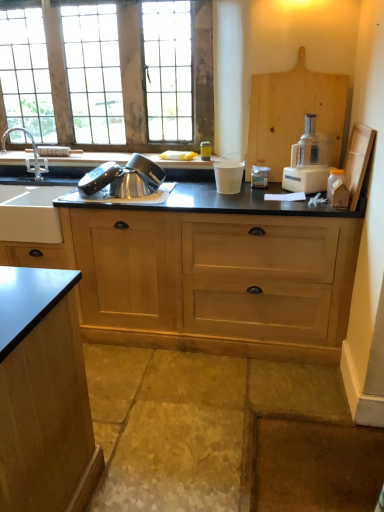
Question: From the image's perspective, is white plastic food processor at right located above or below metallic silver colander at sink?

Choices:
 (A) below
 (B) above

Answer: (B)

Question: Considering the positions of white plastic food processor at right and metallic silver colander at sink in the image, is white plastic food processor at right bigger or smaller than metallic silver colander at sink?

Choices:
 (A) big
 (B) small

Answer: (A)

Question: Which object is positioned farthest from the wooden window at upper left?

Choices:
 (A) black matte countertop at center
 (B) metallic silver colander at sink
 (C) white plastic food processor at right
 (D) silver metallic faucet at left

Answer: (C)

Question: Which object is the closest to the metallic silver colander at sink?

Choices:
 (A) white plastic food processor at right
 (B) wooden window at upper left
 (C) black matte countertop at center
 (D) silver metallic faucet at left

Answer: (C)